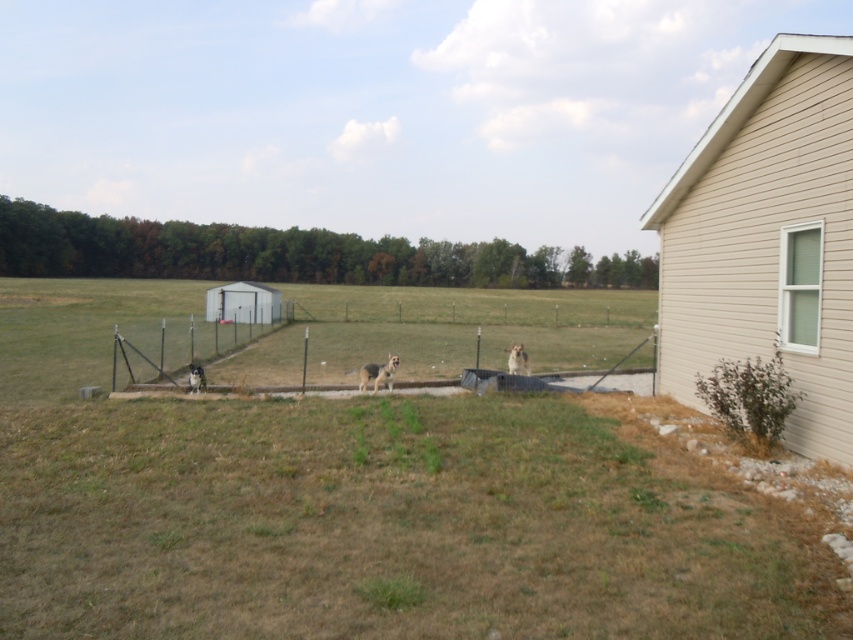
Question: Can you confirm if golden fur dog at center is wider than fuzzy brown dog at lower left?

Choices:
 (A) no
 (B) yes

Answer: (B)

Question: Where is beige siding shed at right located in relation to fuzzy brown dog at lower left in the image?

Choices:
 (A) left
 (B) right

Answer: (B)

Question: Which object appears closest to the camera in this image?

Choices:
 (A) beige siding shed at right
 (B) gray wire fence at center
 (C) golden fur dog at center

Answer: (A)

Question: Which point is closer to the camera?

Choices:
 (A) fuzzy brown dog at lower left
 (B) metallic wire fence at center
 (C) gray wire fence at center

Answer: (A)

Question: Which point is closer to the camera?

Choices:
 (A) (518, 362)
 (B) (695, 211)
 (C) (376, 365)
 (D) (136, 365)

Answer: (B)

Question: Is golden fur dog at center smaller than fuzzy brown dog at center?

Choices:
 (A) yes
 (B) no

Answer: (A)